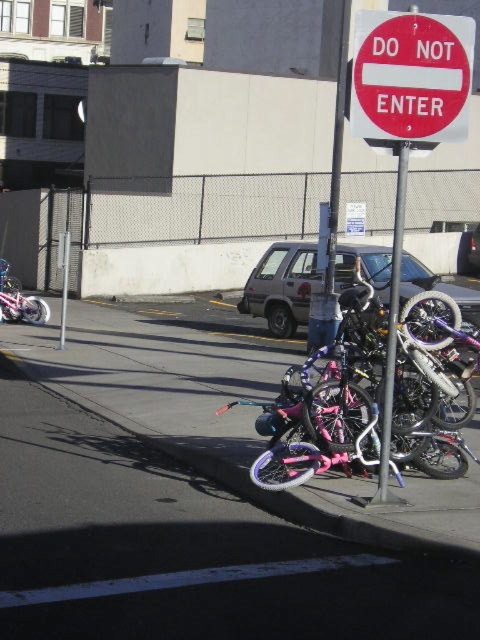
Can you confirm if silver metallic suv at center is wider than brushed metal motorcycle at left?

In fact, silver metallic suv at center might be narrower than brushed metal motorcycle at left.

Does silver metallic suv at center have a lesser width compared to brushed metal motorcycle at left?

Yes, silver metallic suv at center is thinner than brushed metal motorcycle at left.

Where is `silver metallic suv at center`? silver metallic suv at center is located at coordinates (283, 285).

Which is in front, point (375, 544) or point (477, 221)?

Point (375, 544) is more forward.

Does pink metallic bicycle at center appear under silver metallic car at center?

Indeed, pink metallic bicycle at center is positioned under silver metallic car at center.

Is point (31, 522) positioned before point (478, 225)?

Yes, it is in front of point (478, 225).

Identify the location of pink metallic bicycle at center. The image size is (480, 640). (197, 500).

Which is below, metallic pole at center or silver metallic car at center?

metallic pole at center is below.

Can you confirm if metallic pole at center is taller than silver metallic car at center?

Correct, metallic pole at center is much taller as silver metallic car at center.

Does point (396, 340) come farther from viewer compared to point (467, 248)?

No, (396, 340) is in front of (467, 248).

Identify the location of metallic pole at center. Image resolution: width=480 pixels, height=640 pixels. (392, 328).